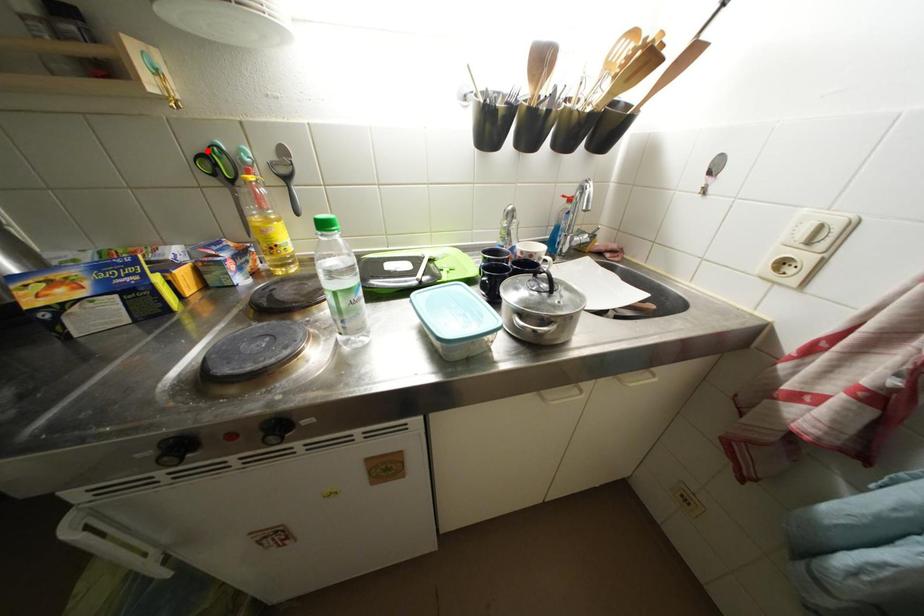
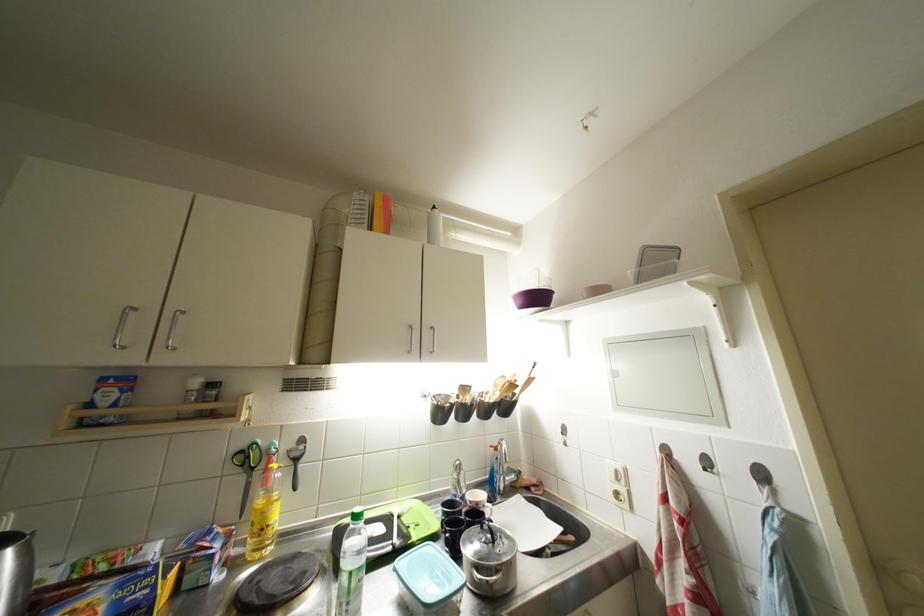
In the second image, find the point that corresponds to the highlighted location in the first image.

(249, 450)